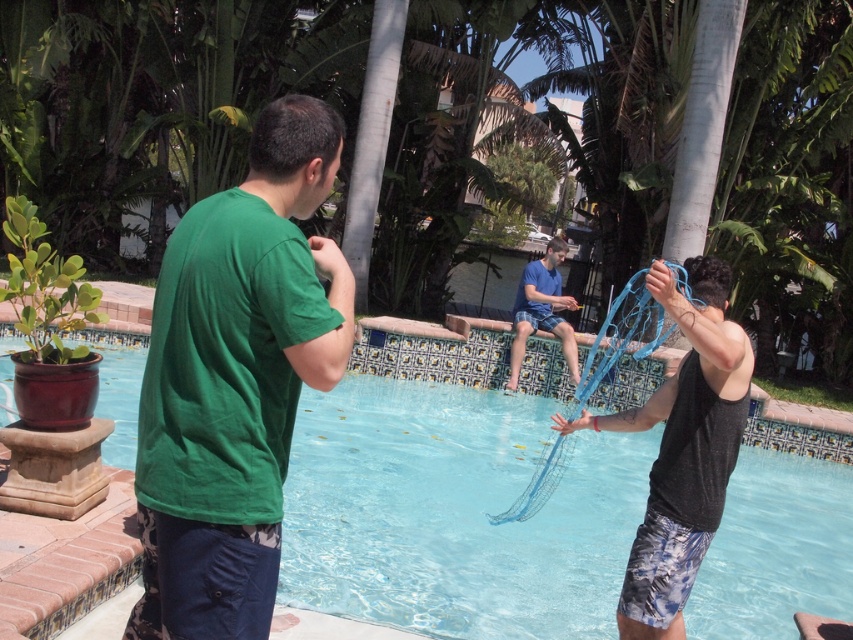
Question: Is transparent blue water at center bigger than blue fabric net at upper center?

Choices:
 (A) yes
 (B) no

Answer: (B)

Question: Is green matte shirt at center to the left of black mesh net at right from the viewer's perspective?

Choices:
 (A) no
 (B) yes

Answer: (B)

Question: Which point is closer to the camera?

Choices:
 (A) green matte shirt at center
 (B) black mesh net at right
 (C) blue fabric net at upper center

Answer: (A)

Question: Which of the following is the farthest from the observer?

Choices:
 (A) green matte shirt at center
 (B) black mesh net at right
 (C) transparent blue water at center

Answer: (C)

Question: Is black mesh net at right wider than blue fabric net at upper center?

Choices:
 (A) yes
 (B) no

Answer: (B)

Question: Estimate the real-world distances between objects in this image. Which object is farther from the green matte shirt at center?

Choices:
 (A) blue fabric net at upper center
 (B) black mesh net at right

Answer: (A)